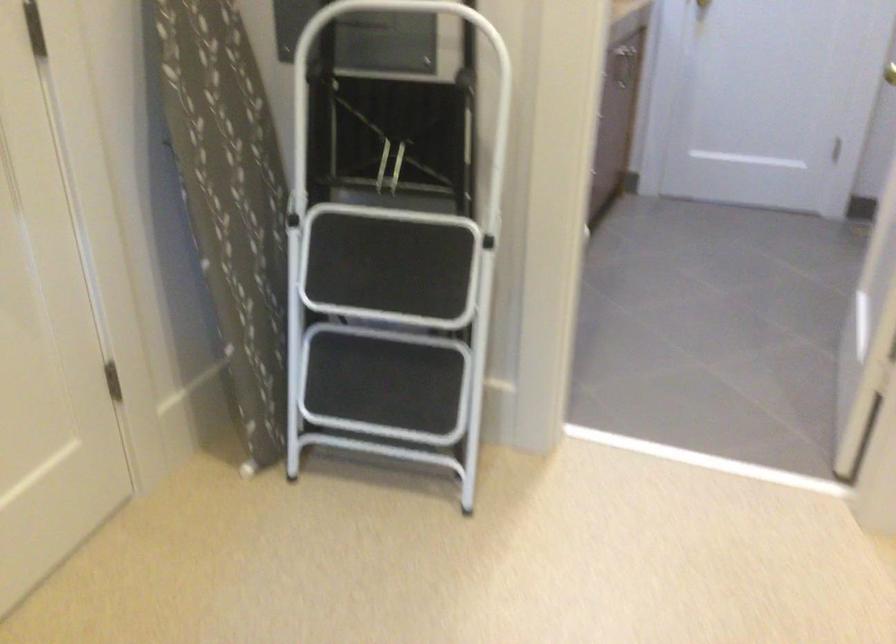
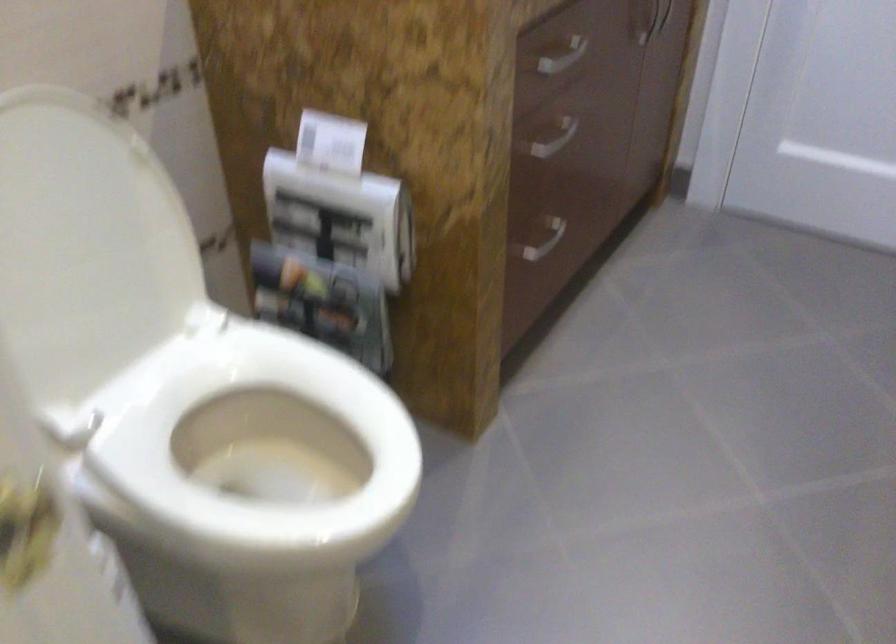
Locate, in the second image, the point that corresponds to [596,129] in the first image.

(554, 138)